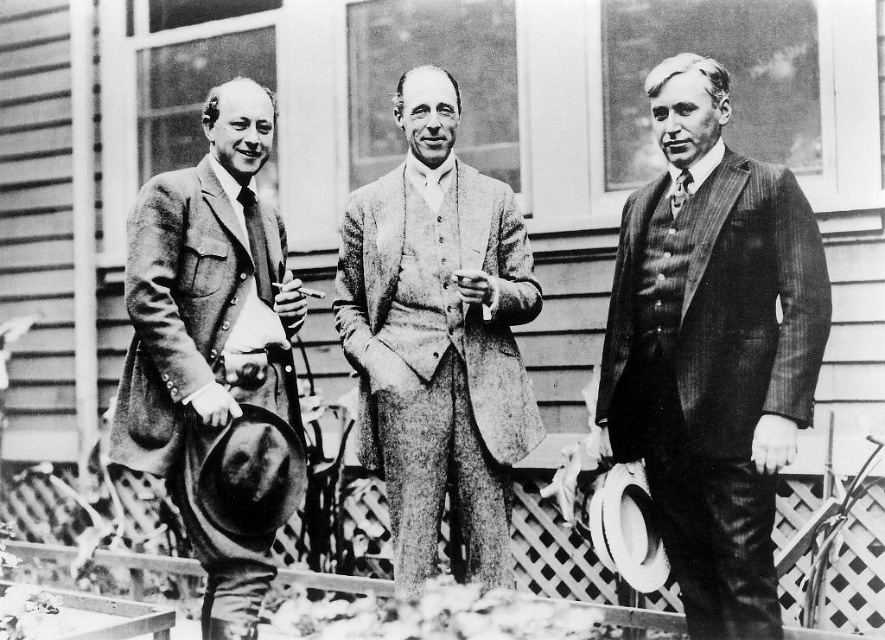
Does point (668, 374) lie in front of point (168, 406)?

No, (668, 374) is further to viewer.

What are the coordinates of `striped wool suit at center` in the screenshot? It's located at (713, 349).

Identify the location of striped wool suit at center. The image size is (885, 640). (713, 349).

Can you confirm if striped wool suit at center is positioned above matte black tie at center?

No, striped wool suit at center is not above matte black tie at center.

Between striped wool suit at center and matte black tie at center, which one has more height?

striped wool suit at center

Is point (704, 172) less distant than point (260, 289)?

Yes, point (704, 172) is closer to viewer.

This screenshot has width=885, height=640. Find the location of `striped wool suit at center`. striped wool suit at center is located at coordinates click(x=713, y=349).

This screenshot has height=640, width=885. What do you see at coordinates (713, 349) in the screenshot?
I see `striped wool suit at center` at bounding box center [713, 349].

Which is more to the right, striped wool suit at center or textured wool suit at center?

striped wool suit at center is more to the right.

Is point (708, 132) positioned behind point (429, 348)?

No, (708, 132) is closer to viewer.

In order to click on striped wool suit at center in this screenshot , I will do `click(713, 349)`.